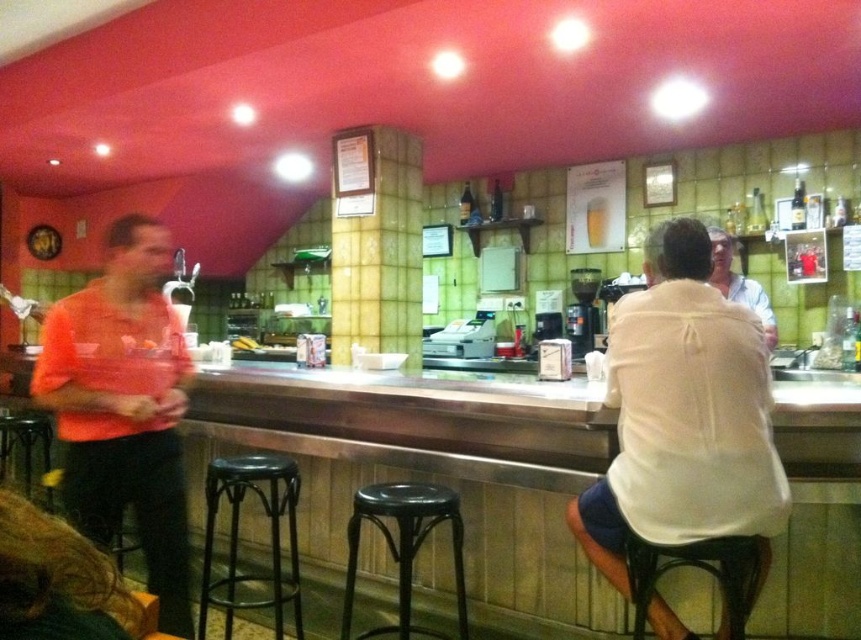
You are a customer trying to sit at the bar. You see the black plastic bar stool at center and the black metal bar stool at lower center. Which one is closer to the floor?

The black plastic bar stool at center is closer to the floor because it is positioned below the black metal bar stool at lower center.